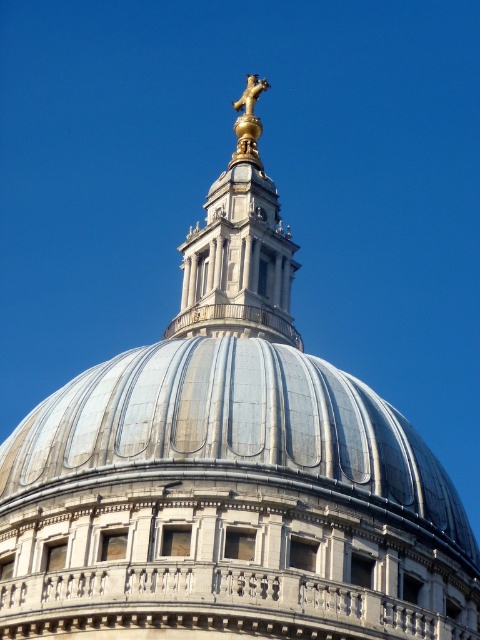
Is point (206, 467) more distant than point (193, 282)?

No.

Which is behind, point (162, 438) or point (182, 314)?

Positioned behind is point (182, 314).

The width and height of the screenshot is (480, 640). I want to click on silver metallic dome at center, so click(236, 433).

You are a GUI agent. You are given a task and a screenshot of the screen. Output one action in this format:
    pyautogui.click(x=<x>, y=<y>)
    Task: Click on the silver metallic dome at center
    
    Given the screenshot: What is the action you would take?
    pyautogui.click(x=236, y=433)

Is gold polished statue at upper center closer to the viewer compared to gold polished statue at top?

Yes.

This screenshot has height=640, width=480. What are the coordinates of `gold polished statue at upper center` in the screenshot? It's located at (239, 248).

Who is more distant from viewer, (225, 296) or (241, 115)?

Point (241, 115)

At what (x,y) coordinates should I click in order to perform the action: click on gold polished statue at upper center. Please return your answer as a coordinate pair (x, y). This screenshot has height=640, width=480. Looking at the image, I should click on (239, 248).

Is point (178, 387) closer to viewer compared to point (252, 128)?

Yes, it is.

Which is behind, point (66, 451) or point (231, 164)?

The point (231, 164) is behind.

Which is behind, point (62, 404) or point (235, 150)?

Positioned behind is point (235, 150).

Identify the location of silver metallic dome at center. (236, 433).